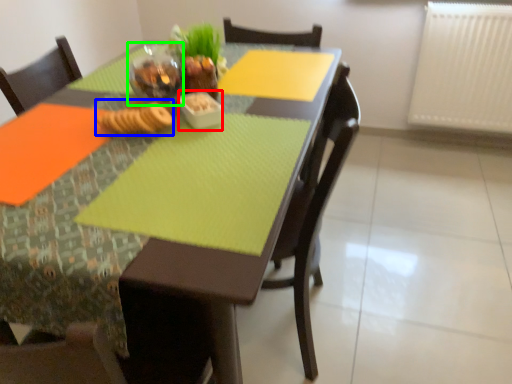
Question: Based on their relative distances, which object is nearer to tableware (highlighted by a red box)? Choose from food (highlighted by a blue box) and tableware (highlighted by a green box).

Choices:
 (A) food
 (B) tableware

Answer: (A)